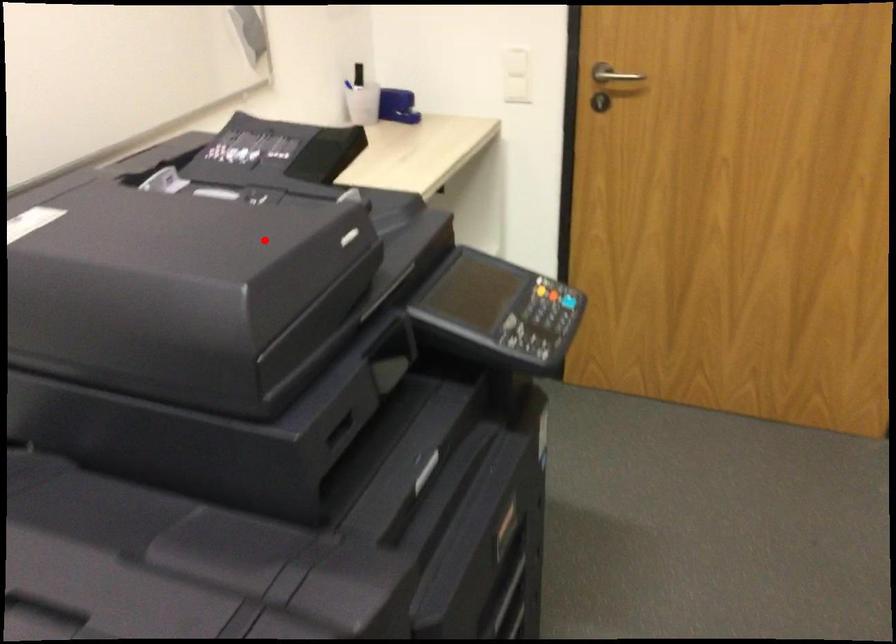
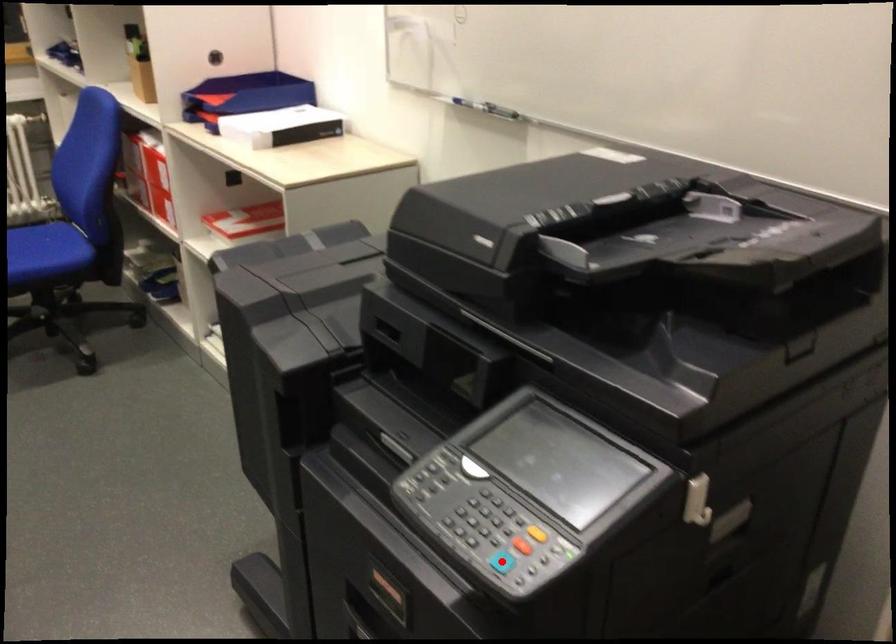
I am providing you with two images of the same scene from different viewpoints. A red point is marked on the first image and another point is marked on the second image. Do the highlighted points in image1 and image2 indicate the same real-world spot?

No